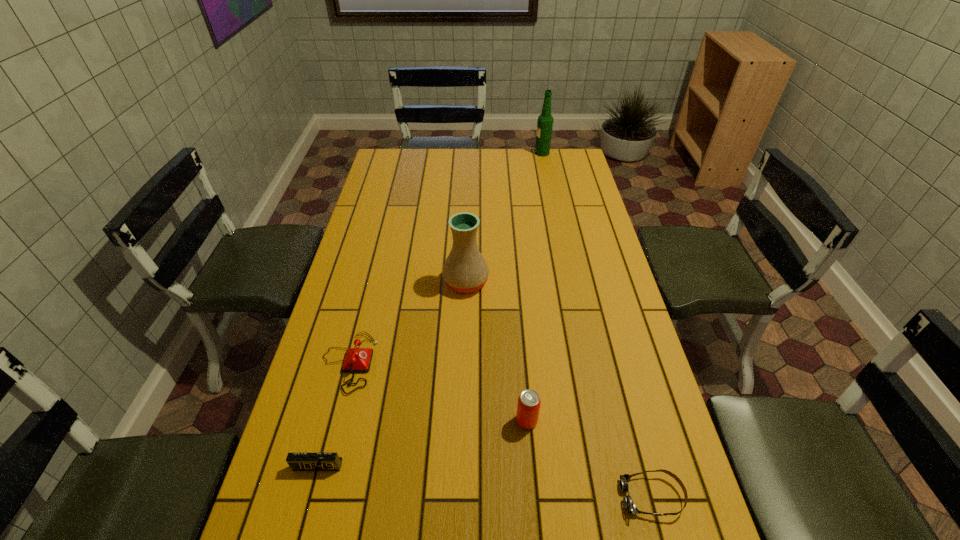
Find the location of a particular element. The height and width of the screenshot is (540, 960). object that is the second closest to the second farthest object is located at coordinates (528, 407).

You are a GUI agent. You are given a task and a screenshot of the screen. Output one action in this format:
    pyautogui.click(x=<x>, y=<y>)
    Task: Click on the object that is the fourth nearest to the third object from left to right
    This screenshot has width=960, height=540.
    Given the screenshot: What is the action you would take?
    pyautogui.click(x=629, y=505)

Identify the location of blank space that satisfies the following two spatial constraints: 1. on the dial of the telephone; 2. on the left side of the beer can. Image resolution: width=960 pixels, height=540 pixels. (333, 421).

Find the location of `blank space that satisfies the following two spatial constraints: 1. on the dial of the telephone; 2. on the front-facing side of the fifth farthest object`. blank space that satisfies the following two spatial constraints: 1. on the dial of the telephone; 2. on the front-facing side of the fifth farthest object is located at coordinates (322, 465).